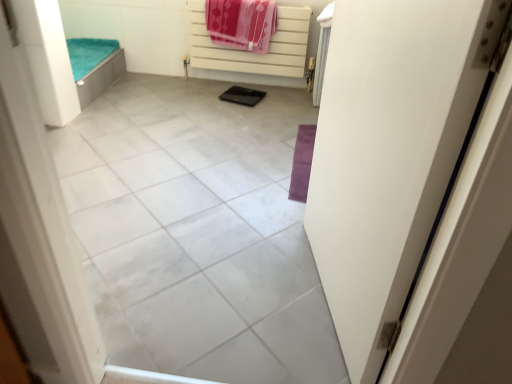
Question: From the image's perspective, is polka dot fabric beach towel at upper center beneath gray tile at center?

Choices:
 (A) yes
 (B) no

Answer: (B)

Question: Is polka dot fabric beach towel at upper center to the left of gray tile at center from the viewer's perspective?

Choices:
 (A) yes
 (B) no

Answer: (B)

Question: Can we say polka dot fabric beach towel at upper center lies outside gray tile at center?

Choices:
 (A) yes
 (B) no

Answer: (A)

Question: Is the position of polka dot fabric beach towel at upper center less distant than that of gray tile at center?

Choices:
 (A) no
 (B) yes

Answer: (A)

Question: Is gray tile at center a part of polka dot fabric beach towel at upper center?

Choices:
 (A) yes
 (B) no

Answer: (B)

Question: Does polka dot fabric beach towel at upper center have a greater height compared to gray tile at center?

Choices:
 (A) yes
 (B) no

Answer: (A)

Question: Is white matte radiator at upper center thinner than white matte door at right?

Choices:
 (A) yes
 (B) no

Answer: (A)

Question: Is white matte door at right surrounded by white matte radiator at upper center?

Choices:
 (A) no
 (B) yes

Answer: (A)

Question: From the image's perspective, does white matte radiator at upper center appear higher than white matte door at right?

Choices:
 (A) yes
 (B) no

Answer: (A)

Question: Considering the relative sizes of white matte radiator at upper center and white matte door at right in the image provided, is white matte radiator at upper center shorter than white matte door at right?

Choices:
 (A) no
 (B) yes

Answer: (B)

Question: From the image's perspective, is white matte radiator at upper center located beneath white matte door at right?

Choices:
 (A) yes
 (B) no

Answer: (B)

Question: Considering the relative sizes of white matte radiator at upper center and white matte door at right in the image provided, is white matte radiator at upper center bigger than white matte door at right?

Choices:
 (A) no
 (B) yes

Answer: (A)

Question: Considering the relative sizes of gray tile at center and white matte radiator at upper center in the image provided, is gray tile at center thinner than white matte radiator at upper center?

Choices:
 (A) no
 (B) yes

Answer: (A)